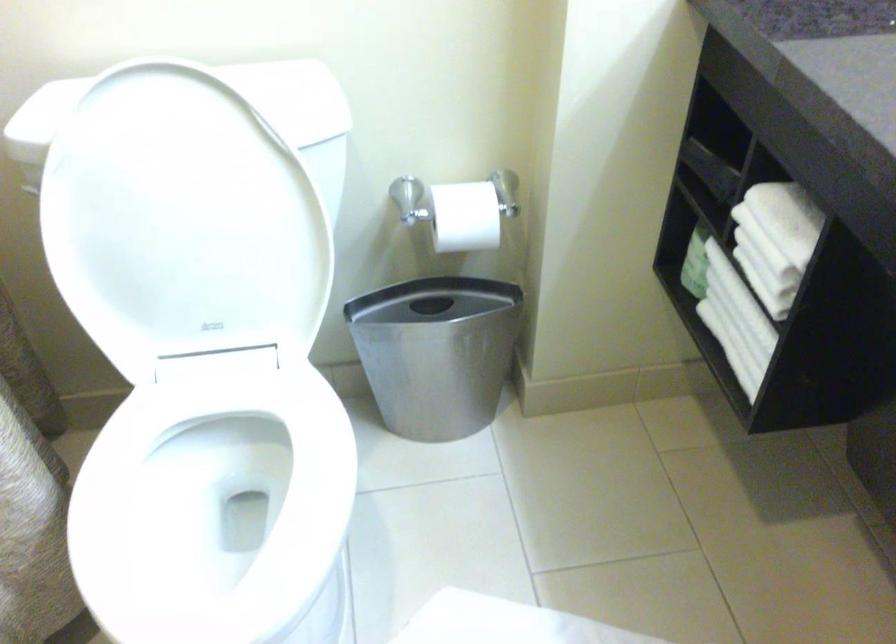
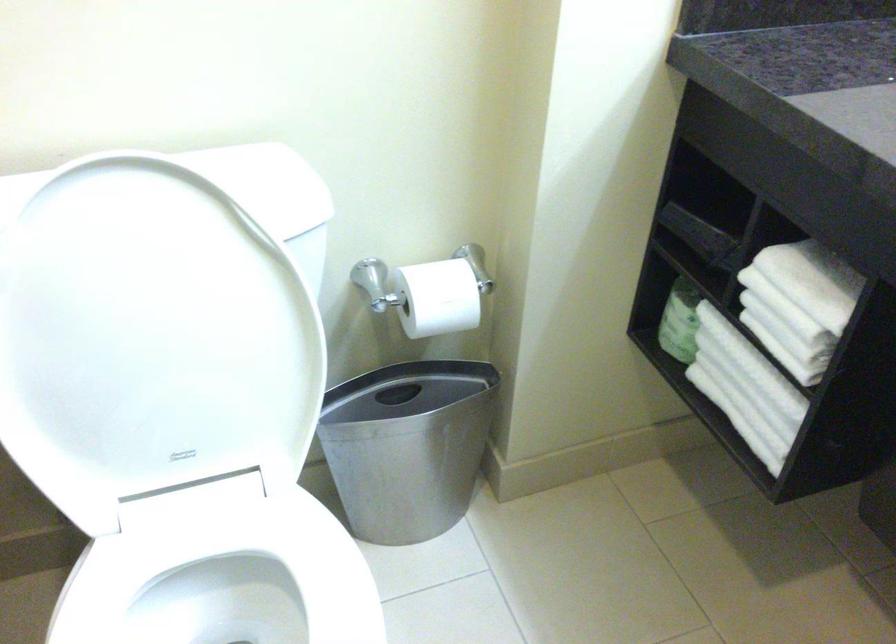
Where in the second image is the point corresponding to the point at 761,243 from the first image?

(785, 308)